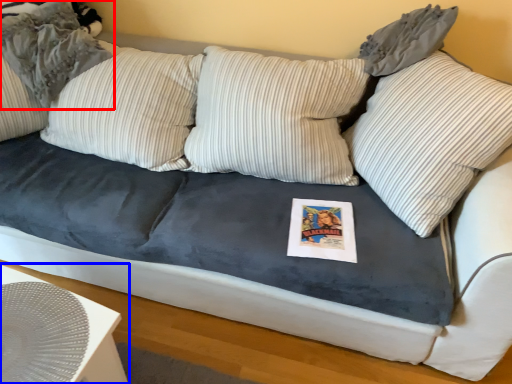
Question: Which object appears closest to the camera in this image, pillow (highlighted by a red box) or table (highlighted by a blue box)?

Choices:
 (A) pillow
 (B) table

Answer: (B)